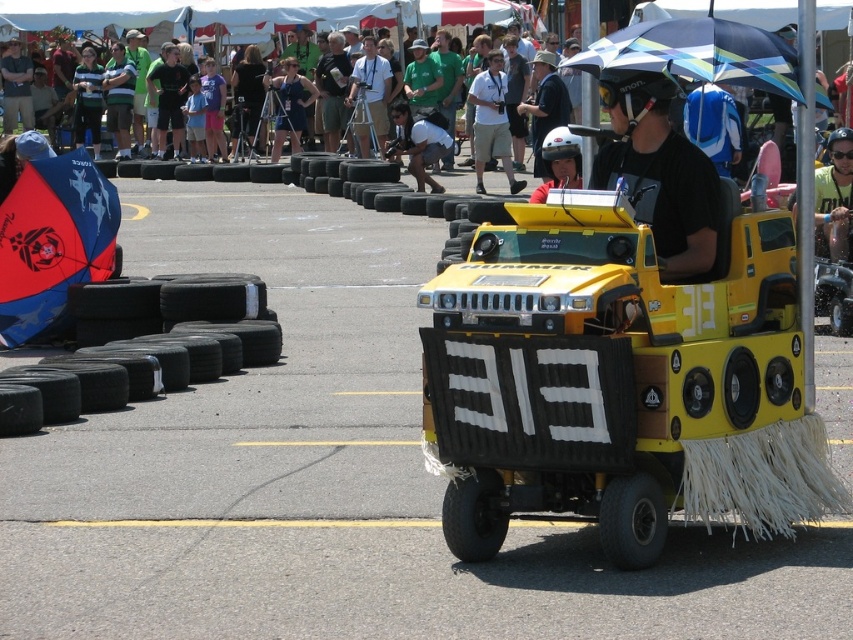
Question: Does black matte helmet at center have a larger size compared to blue and white striped umbrella at center?

Choices:
 (A) yes
 (B) no

Answer: (A)

Question: Which object is farther from the camera taking this photo?

Choices:
 (A) green cotton t-shirt at upper center
 (B) black matte helmet at center
 (C) black rubber tire at left
 (D) white matte helmet at center

Answer: (A)

Question: Estimate the real-world distances between objects in this image. Which object is closer to the blue fabric umbrella at left?

Choices:
 (A) blue and white striped umbrella at center
 (B) white matte helmet at center
 (C) blue denim shirt at center
 (D) green cotton t-shirt at upper center

Answer: (B)

Question: Which of the following is the closest to the observer?

Choices:
 (A) blue and white striped umbrella at center
 (B) blue fabric umbrella at left
 (C) matte black helmet at center

Answer: (A)

Question: Can you confirm if yellow matte hummer at center is positioned to the right of blue denim shirt at center?

Choices:
 (A) yes
 (B) no

Answer: (A)

Question: Can you confirm if yellow matte hummer at center is wider than blue denim shirt at center?

Choices:
 (A) no
 (B) yes

Answer: (B)